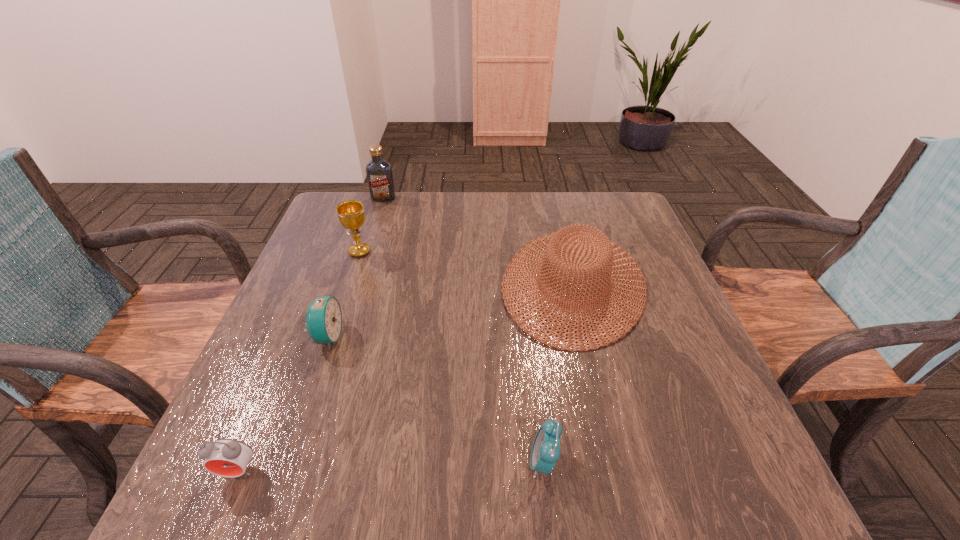
The height and width of the screenshot is (540, 960). Find the location of `object located at the near left corner`. object located at the near left corner is located at coordinates (225, 457).

Where is `object that is positioned at the far right corner`? object that is positioned at the far right corner is located at coordinates (552, 249).

In the image, there is a desktop. Identify the location of free space at the far edge. The image size is (960, 540). (518, 210).

In the image, there is a desktop. Identify the location of vacant space at the near edge. This screenshot has height=540, width=960. tap(482, 490).

In the image, there is a desktop. In order to click on vacant area at the left edge in this screenshot , I will do `click(353, 271)`.

In the image, there is a desktop. At what (x,y) coordinates should I click in order to perform the action: click on vacant space at the right edge. Please return your answer as a coordinate pair (x, y). The height and width of the screenshot is (540, 960). Looking at the image, I should click on (688, 350).

The image size is (960, 540). Find the location of `vacant space at the near left corner`. vacant space at the near left corner is located at coordinates (291, 464).

The width and height of the screenshot is (960, 540). Identify the location of free space at the far right corner of the desktop. (588, 218).

The image size is (960, 540). I want to click on free space between the rightmost alarm clock and the leftmost object, so click(x=391, y=467).

Find the location of `free space between the sunhat and the vodka`. free space between the sunhat and the vodka is located at coordinates (478, 241).